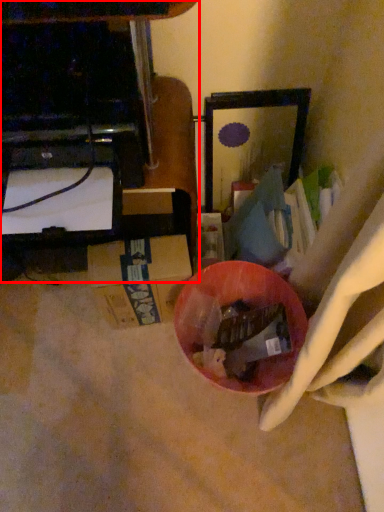
Question: From the image's perspective, considering the relative positions of furniture (annotated by the red box) and bowl in the image provided, where is furniture (annotated by the red box) located with respect to the staircase?

Choices:
 (A) below
 (B) above

Answer: (B)